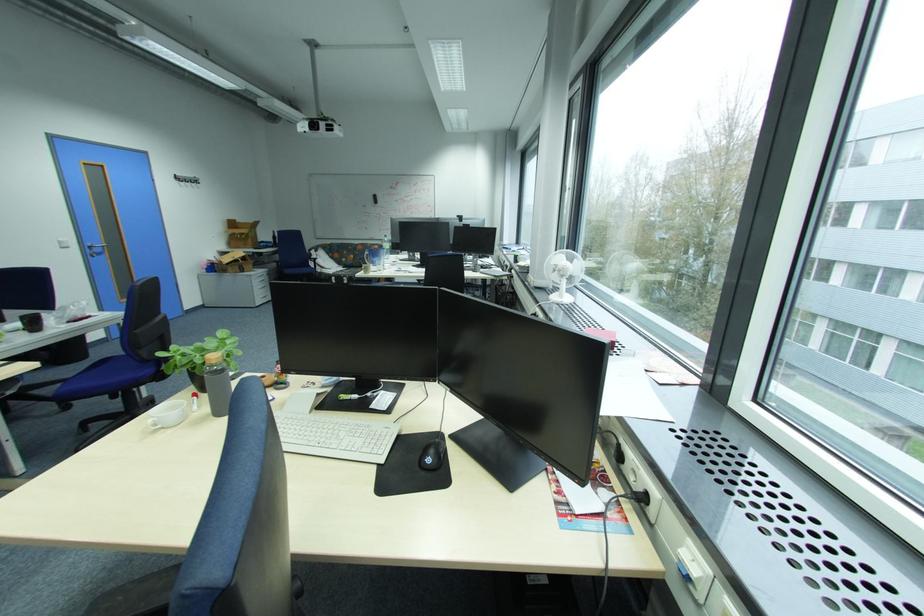
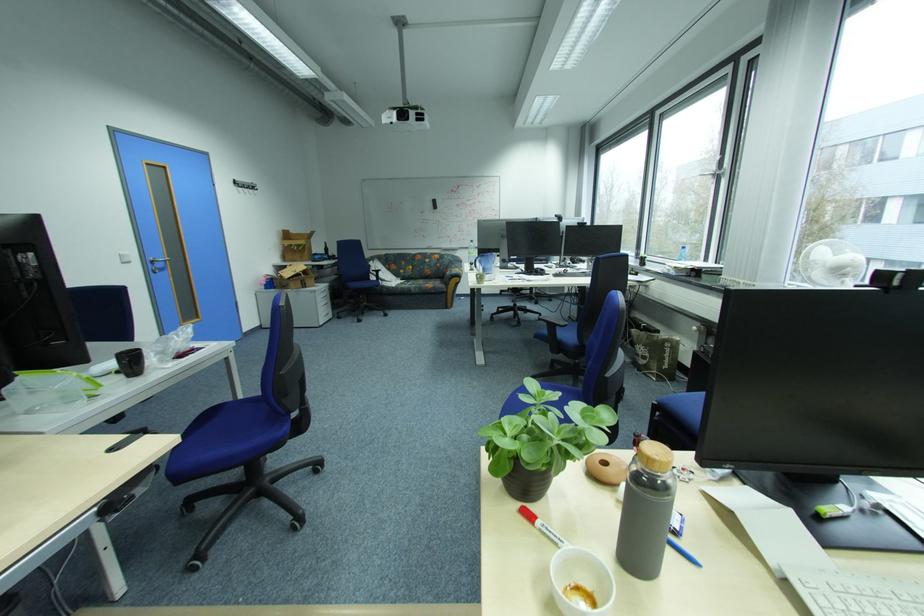
The point at [263,298] is marked in the first image. Where is the corresponding point in the second image?

(326, 315)